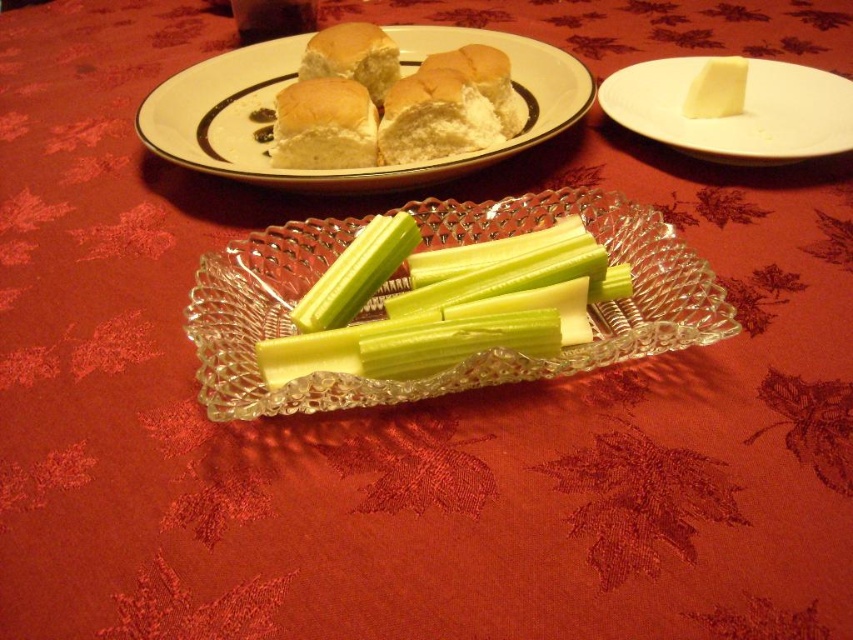
Question: Which object appears farthest from the camera in this image?

Choices:
 (A) white glazed plate at upper center
 (B) matte white bread at upper center

Answer: (B)

Question: Is white glazed plate at upper center above matte golden-brown bread at upper center?

Choices:
 (A) no
 (B) yes

Answer: (A)

Question: Does clear glass tray at center appear on the right side of white glazed plate at upper center?

Choices:
 (A) yes
 (B) no

Answer: (A)

Question: Does white smooth butter at upper right come in front of yellow creamy cheese at upper right?

Choices:
 (A) yes
 (B) no

Answer: (A)

Question: Which point is farther to the camera?

Choices:
 (A) (735, 83)
 (B) (363, 60)
 (C) (149, 144)

Answer: (B)

Question: Which point appears closest to the camera in this image?

Choices:
 (A) (701, 108)
 (B) (363, 252)
 (C) (573, 120)
 (D) (361, 74)

Answer: (B)